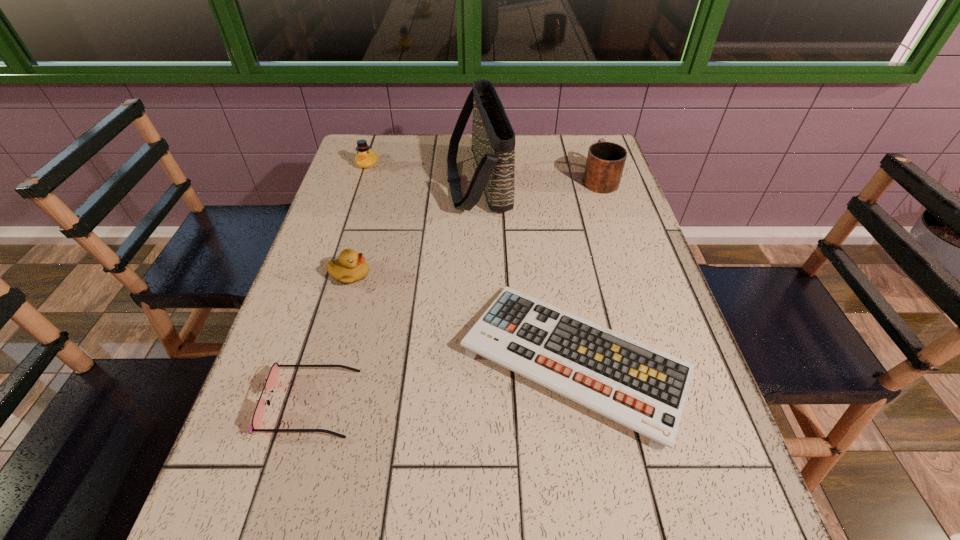
The height and width of the screenshot is (540, 960). In order to click on free space that satisfies the following two spatial constraints: 1. at the beak of the computer keyboard; 2. on the left side of the duckling in this screenshot , I will do `click(325, 360)`.